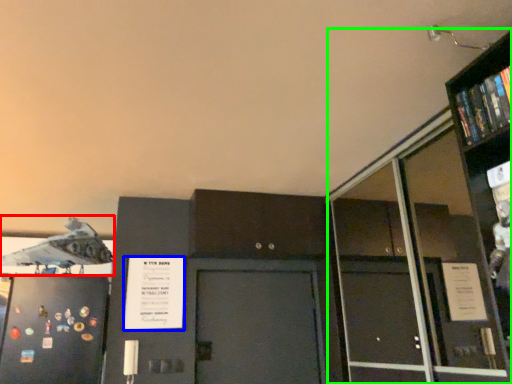
Question: Which object is the closest to the airplane (highlighted by a red box)? Choose among these: poster (highlighted by a blue box) or bookcase (highlighted by a green box).

Choices:
 (A) poster
 (B) bookcase

Answer: (A)